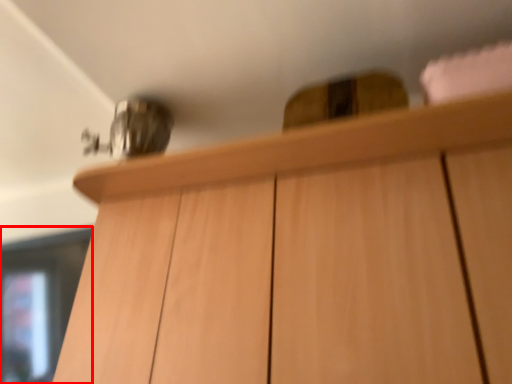
Question: From the image's perspective, where is glass door (annotated by the red box) located in relation to cabinetry in the image?

Choices:
 (A) below
 (B) above

Answer: (A)